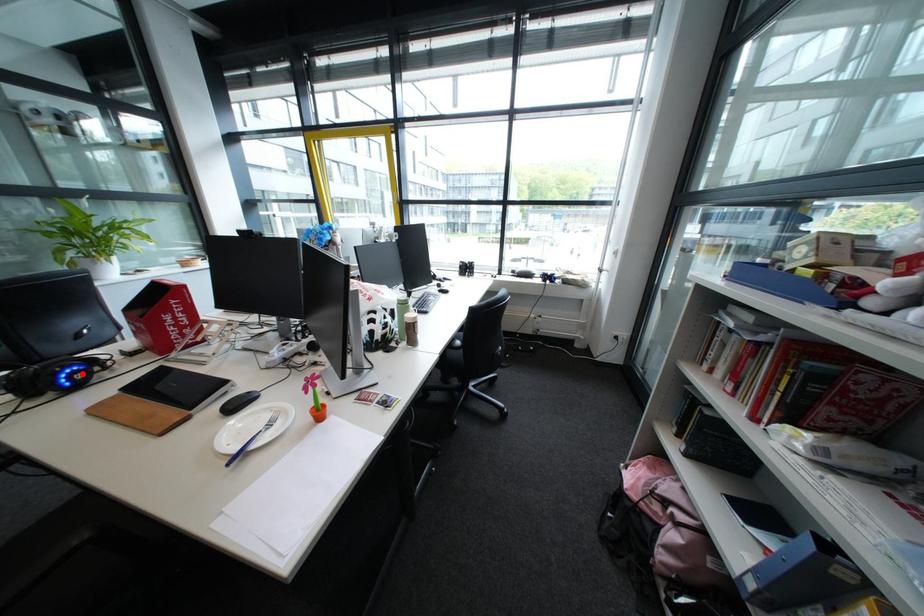
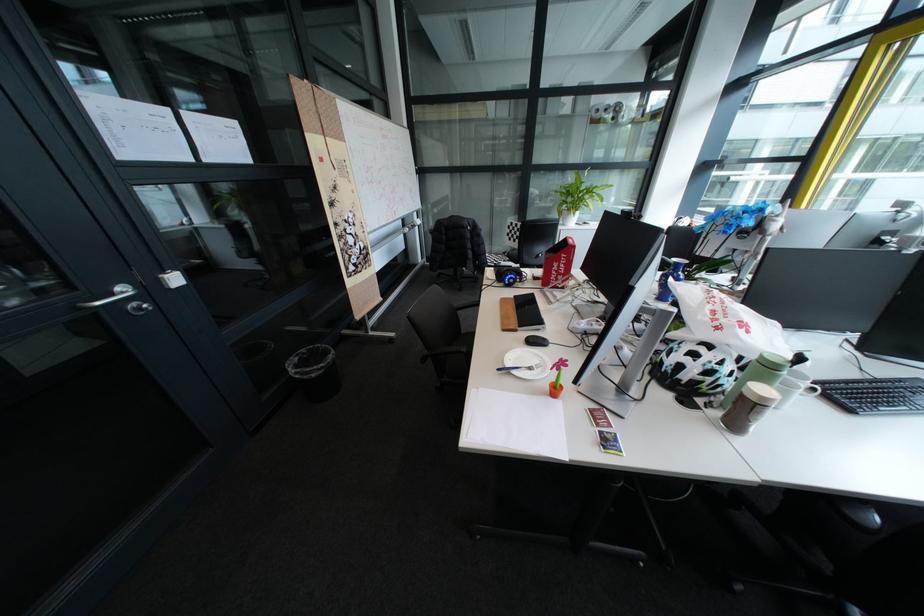
Locate, in the second image, the point that corresponds to the highlighted location in the first image.

(523, 278)